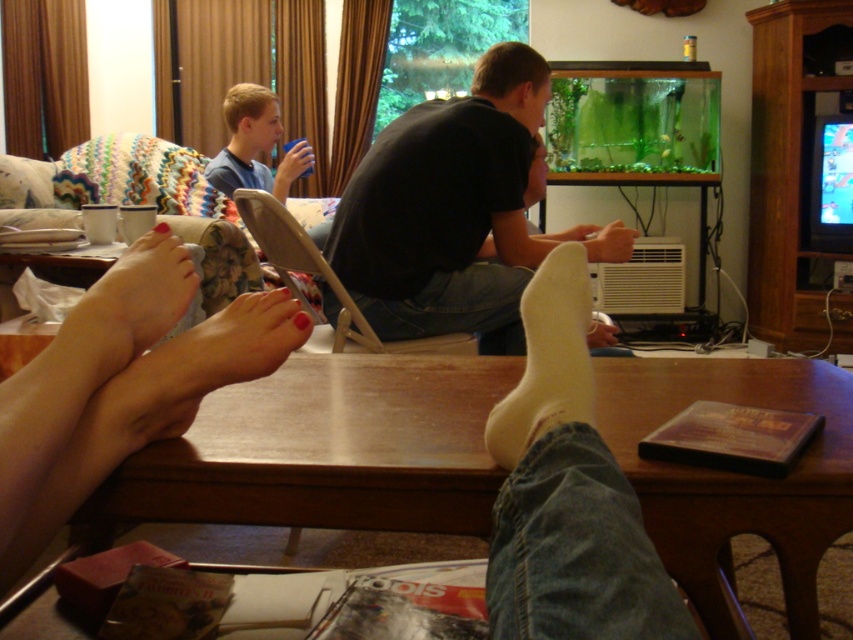
Question: Considering the real-world distances, which object is closest to the black matte shirt at center?

Choices:
 (A) white soft sock at lower center
 (B) white sock at lower right

Answer: (A)

Question: Which object is the closest to the white sock at lower right?

Choices:
 (A) white soft sock at lower center
 (B) black matte shirt at center

Answer: (A)

Question: Can you confirm if white sock at lower right is smaller than white soft sock at lower center?

Choices:
 (A) yes
 (B) no

Answer: (B)

Question: Does white sock at lower right appear on the left side of black matte shirt at center?

Choices:
 (A) no
 (B) yes

Answer: (B)

Question: Among these points, which one is nearest to the camera?

Choices:
 (A) (445, 275)
 (B) (585, 432)
 (C) (538, 362)

Answer: (B)

Question: Does white sock at lower right appear under white soft sock at lower center?

Choices:
 (A) yes
 (B) no

Answer: (A)